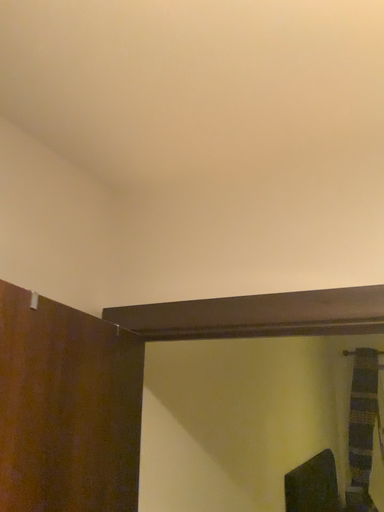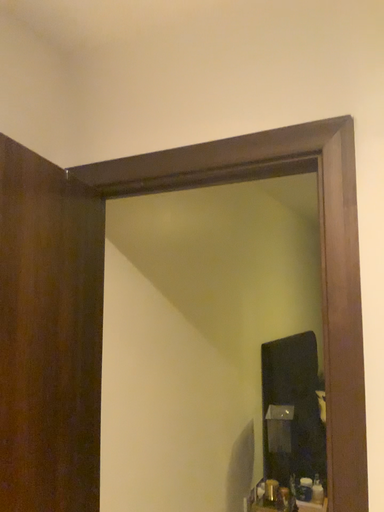
Question: How did the camera likely rotate when shooting the video?

Choices:
 (A) rotated upward
 (B) rotated downward

Answer: (B)